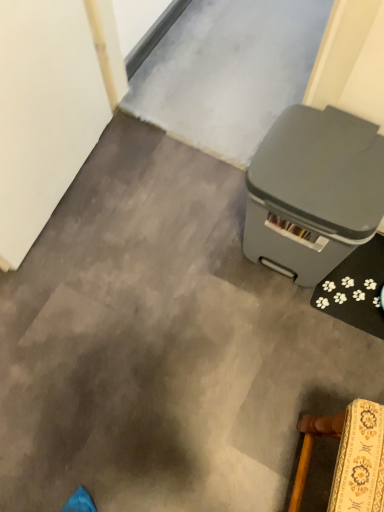
Describe the element at coordinates (348, 457) in the screenshot. This screenshot has width=384, height=512. I see `wooden upholstered chair at lower right` at that location.

In order to face wooden upholstered chair at lower right, should I rotate leftwards or rightwards?

You should look right and rotate roughly 22.112 degrees.

Identify the location of wooden upholstered chair at lower right. This screenshot has width=384, height=512. (348, 457).

Measure the distance between point (373, 503) and camera.

A distance of 25.47 inches exists between point (373, 503) and camera.

The image size is (384, 512). What do you see at coordinates (313, 191) in the screenshot?
I see `gray plastic waste bin at right` at bounding box center [313, 191].

This screenshot has height=512, width=384. I want to click on gray plastic waste bin at right, so click(313, 191).

What is the approximate height of gray plastic waste bin at right?

gray plastic waste bin at right is 17.44 inches in height.

Identify the location of wooden upholstered chair at lower right. (348, 457).

Can you confirm if wooden upholstered chair at lower right is positioned to the left of gray plastic waste bin at right?

In fact, wooden upholstered chair at lower right is to the right of gray plastic waste bin at right.

Between wooden upholstered chair at lower right and gray plastic waste bin at right, which one is positioned behind?

gray plastic waste bin at right is further away from the camera.

Is point (369, 508) farther from camera compared to point (268, 204)?

That is False.

Looking at this image, from the image's perspective, between wooden upholstered chair at lower right and gray plastic waste bin at right, which one is located above?

From the image's view, gray plastic waste bin at right is above.

From a real-world perspective, which object stands above the other?

wooden upholstered chair at lower right.

Considering the sizes of objects wooden upholstered chair at lower right and gray plastic waste bin at right in the image provided, who is wider, wooden upholstered chair at lower right or gray plastic waste bin at right?

With larger width is gray plastic waste bin at right.

From the picture: Between wooden upholstered chair at lower right and gray plastic waste bin at right, which one has less height?

gray plastic waste bin at right.

Which of these two, wooden upholstered chair at lower right or gray plastic waste bin at right, is smaller?

wooden upholstered chair at lower right is smaller.

Is wooden upholstered chair at lower right inside or outside of gray plastic waste bin at right?

The correct answer is: outside.

Does wooden upholstered chair at lower right touch gray plastic waste bin at right?

wooden upholstered chair at lower right and gray plastic waste bin at right are not in contact.

Is wooden upholstered chair at lower right facing towards gray plastic waste bin at right?

No, wooden upholstered chair at lower right is not aimed at gray plastic waste bin at right.

How different are the orientations of wooden upholstered chair at lower right and gray plastic waste bin at right in degrees?

80.6 degrees.

Locate an element on the screen. furniture that is below the gray plastic waste bin at right (from the image's perspective) is located at coordinates (348, 457).

Based on their positions, is gray plastic waste bin at right located to the left or right of wooden upholstered chair at lower right?

Based on their positions, gray plastic waste bin at right is located to the left of wooden upholstered chair at lower right.

Is gray plastic waste bin at right closer to camera compared to wooden upholstered chair at lower right?

No, gray plastic waste bin at right is behind wooden upholstered chair at lower right.

Is point (349, 177) closer or farther from the camera than point (338, 464)?

Point (349, 177) is farther from the camera than point (338, 464).

From the image's perspective, which object appears higher, gray plastic waste bin at right or wooden upholstered chair at lower right?

gray plastic waste bin at right, from the image's perspective.

Looking at this image, from a real-world perspective, relative to wooden upholstered chair at lower right, is gray plastic waste bin at right vertically above or below?

Clearly, from a real-world perspective, gray plastic waste bin at right is below wooden upholstered chair at lower right.

Is gray plastic waste bin at right wider than wooden upholstered chair at lower right?

Yes, gray plastic waste bin at right is wider than wooden upholstered chair at lower right.

In terms of height, does gray plastic waste bin at right look taller or shorter compared to wooden upholstered chair at lower right?

gray plastic waste bin at right is shorter than wooden upholstered chair at lower right.

Considering the relative sizes of gray plastic waste bin at right and wooden upholstered chair at lower right in the image provided, is gray plastic waste bin at right bigger than wooden upholstered chair at lower right?

Indeed, gray plastic waste bin at right has a larger size compared to wooden upholstered chair at lower right.

Is gray plastic waste bin at right positioned beyond the bounds of wooden upholstered chair at lower right?

gray plastic waste bin at right lies outside wooden upholstered chair at lower right's area.

Is gray plastic waste bin at right touching wooden upholstered chair at lower right?

No, gray plastic waste bin at right is not next to wooden upholstered chair at lower right.

Is gray plastic waste bin at right facing towards wooden upholstered chair at lower right?

No, gray plastic waste bin at right is not facing towards wooden upholstered chair at lower right.

Locate an element on the screen. Image resolution: width=384 pixels, height=512 pixels. furniture on the right of gray plastic waste bin at right is located at coordinates (348, 457).

Image resolution: width=384 pixels, height=512 pixels. I want to click on furniture above the gray plastic waste bin at right (from a real-world perspective), so [x=348, y=457].

In order to click on waste container below the wooden upholstered chair at lower right (from a real-world perspective) in this screenshot , I will do `click(313, 191)`.